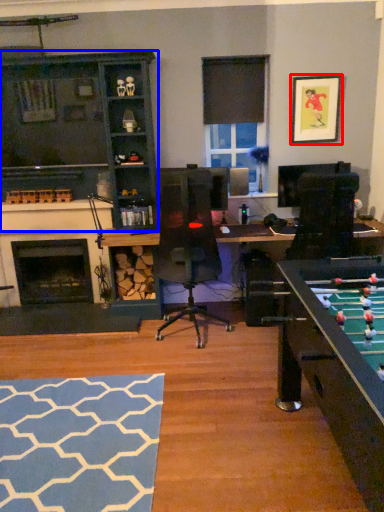
Question: Which point is closer to the camera, picture frame (highlighted by a red box) or cabinetry (highlighted by a blue box)?

Choices:
 (A) picture frame
 (B) cabinetry

Answer: (B)